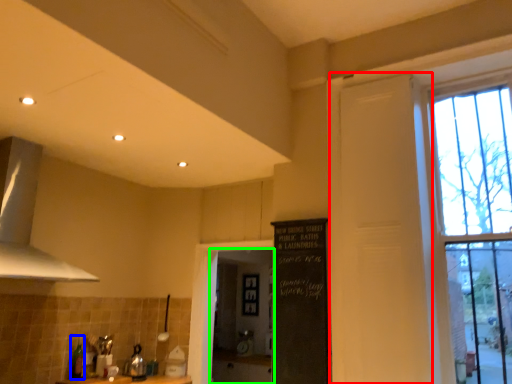
Question: Estimate the real-world distances between objects in this image. Which object is closer to screen door (highlighted by a red box), bottle (highlighted by a blue box) or screen door (highlighted by a green box)?

Choices:
 (A) bottle
 (B) screen door

Answer: (A)